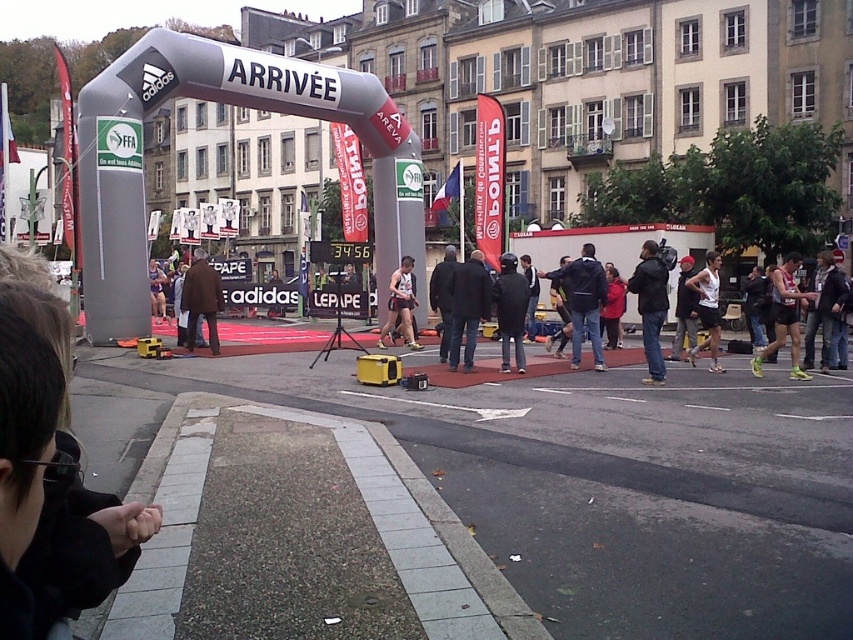
You are a photographer at the finish line of a running event. You need to capture a closeup shot of the two athletes wearing the brown leather jacket at center and matte black tank top at center. Which athlete should you focus on first to ensure their clothing is clearly visible in the photo?

The brown leather jacket at center is larger in size than the matte black tank top at center, so focusing on the athlete wearing the brown leather jacket at center first will ensure their clothing is clearly visible.

You are a photographer positioned at the finish line of the running event. You need to capture a photo of the winner crossing the red carpet under the inflatable archway. Where should you position your matte black camera at center to ensure the winner is in frame?

The matte black camera at center is already positioned at coordinates point (651,307), which is the optimal location to capture the winner crossing the red carpet under the inflatable archway.